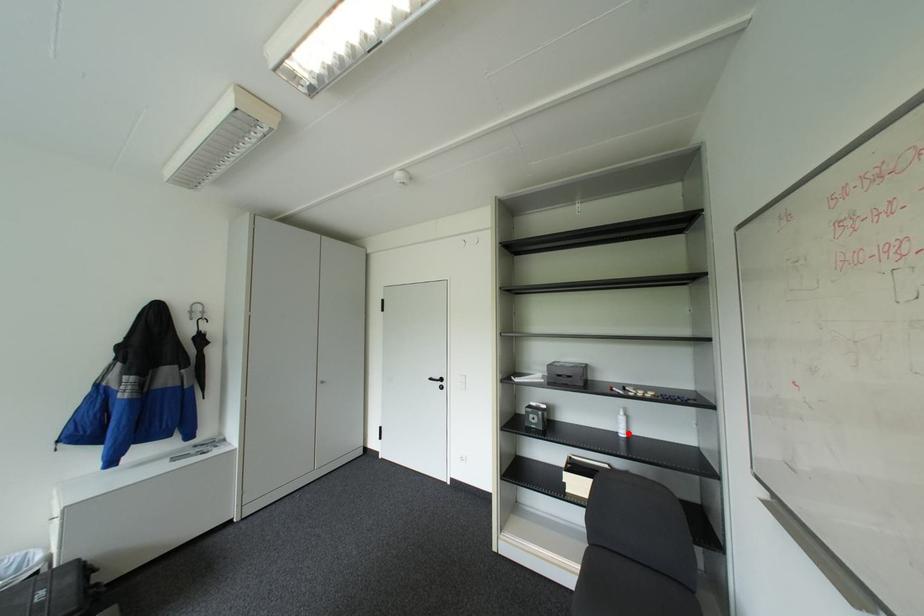
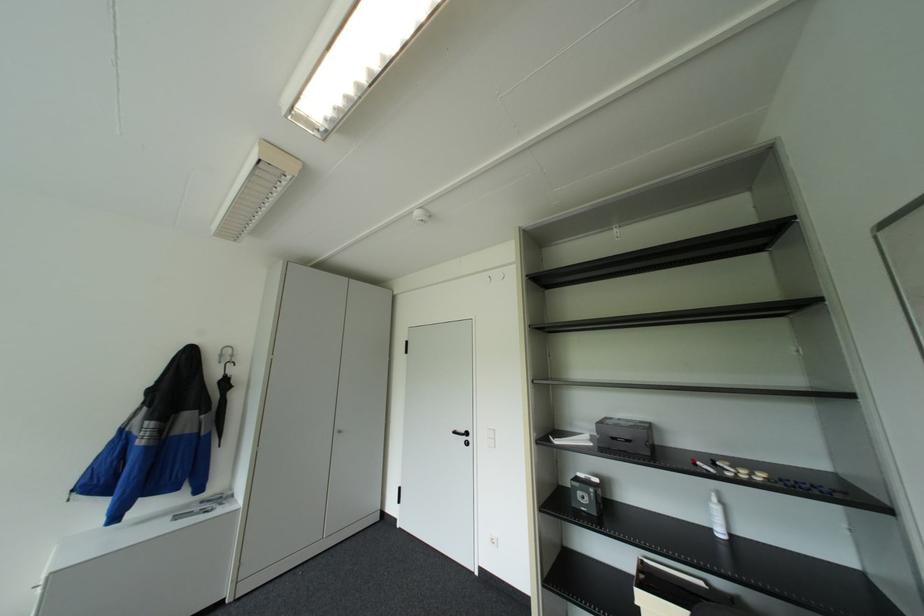
In the second image, find the point that corresponds to the highlighted location in the first image.

(725, 533)